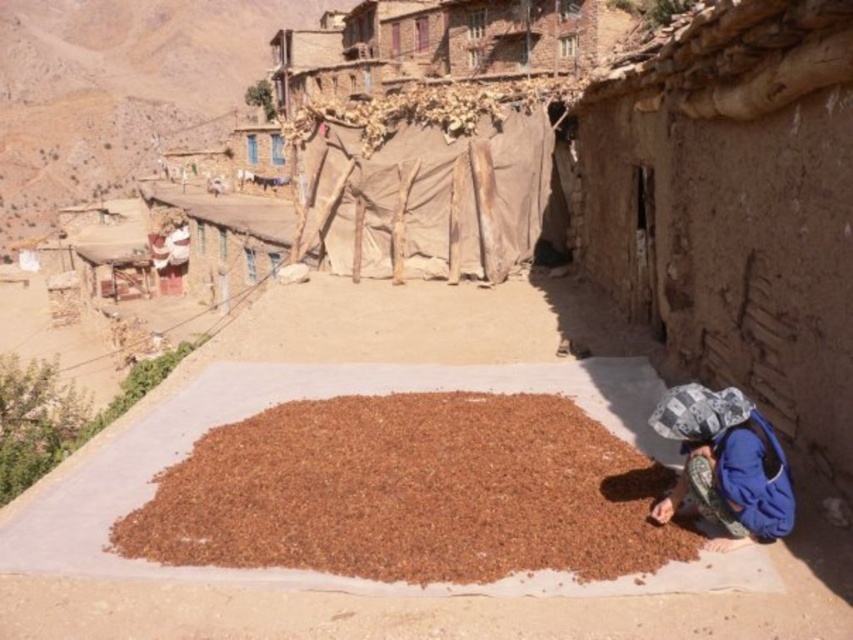
Question: Which of the following is the farthest from the observer?

Choices:
 (A) brown gravel at center
 (B) blue fabric at lower right

Answer: (A)

Question: Does brown gravel at center appear on the left side of blue fabric at lower right?

Choices:
 (A) no
 (B) yes

Answer: (B)

Question: Does brown gravel at center have a smaller size compared to blue fabric at lower right?

Choices:
 (A) no
 (B) yes

Answer: (A)

Question: Does brown gravel at center have a larger size compared to blue fabric at lower right?

Choices:
 (A) yes
 (B) no

Answer: (A)

Question: Which point is farther to the camera?

Choices:
 (A) blue fabric at lower right
 (B) brown gravel at center

Answer: (B)

Question: Which of the following is the closest to the observer?

Choices:
 (A) blue fabric at lower right
 (B) brown gravel at center

Answer: (A)